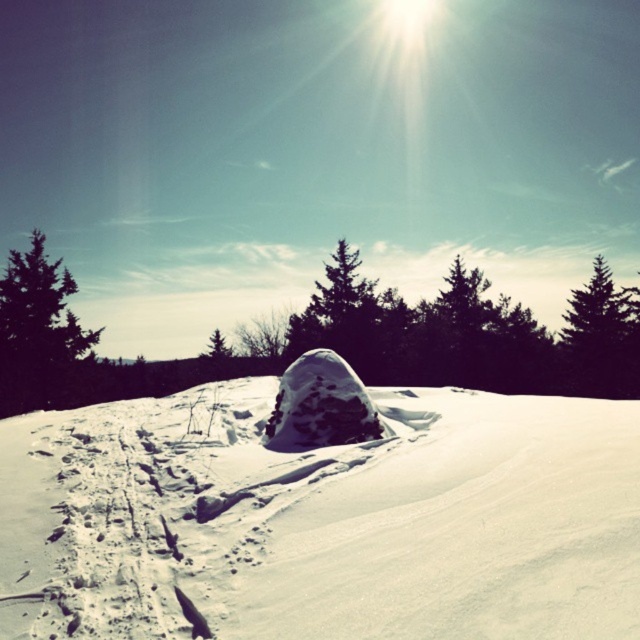
Question: Which object is closer to the camera taking this photo?

Choices:
 (A) green textured pine tree at right
 (B) white snow-covered mound at center
 (C) green leafy tree at left

Answer: (B)

Question: From the image, what is the correct spatial relationship of white snow-covered mound at center in relation to green leafy tree at left?

Choices:
 (A) above
 (B) below

Answer: (B)

Question: Can you confirm if white snow-covered mound at center is smaller than green textured pine tree at right?

Choices:
 (A) no
 (B) yes

Answer: (B)

Question: Can you confirm if white snow-covered mound at center is smaller than green leafy tree at left?

Choices:
 (A) no
 (B) yes

Answer: (B)

Question: Which object is closer to the camera taking this photo?

Choices:
 (A) green textured pine tree at right
 (B) white snow-covered mound at center

Answer: (B)

Question: Which of these objects is positioned farthest from the green leafy tree at left?

Choices:
 (A) white snow-covered mound at center
 (B) green textured pine tree at right

Answer: (B)